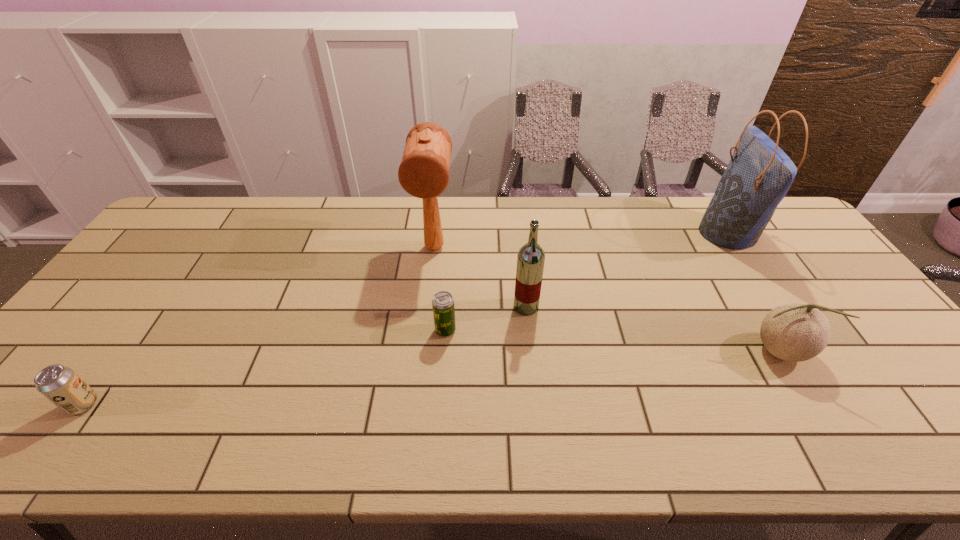
Find the location of `shopping bag`. shopping bag is located at coordinates (759, 174).

Where is `mallet`? This screenshot has width=960, height=540. mallet is located at coordinates (424, 170).

Identify the location of the fourth object from left to right. (530, 260).

Where is `the fourth shortest object`? the fourth shortest object is located at coordinates (530, 260).

Where is `the fourth tallest object`? The image size is (960, 540). the fourth tallest object is located at coordinates (796, 332).

Identify the location of the farther beer can. Image resolution: width=960 pixels, height=540 pixels. (443, 306).

What are the coordinates of `the left beer can` in the screenshot? It's located at (59, 384).

You are a GUI agent. You are given a task and a screenshot of the screen. Output one action in this format:
    pyautogui.click(x=<x>, y=<y>)
    Task: Click on the nearest object
    This screenshot has height=540, width=960.
    Given the screenshot: What is the action you would take?
    pyautogui.click(x=59, y=384)

Identify the location of free region located 0.050m on the front of the shopping bag. (754, 274).

This screenshot has width=960, height=540. I want to click on vacant space located 0.350m on the strike surface of the mallet, so click(x=420, y=368).